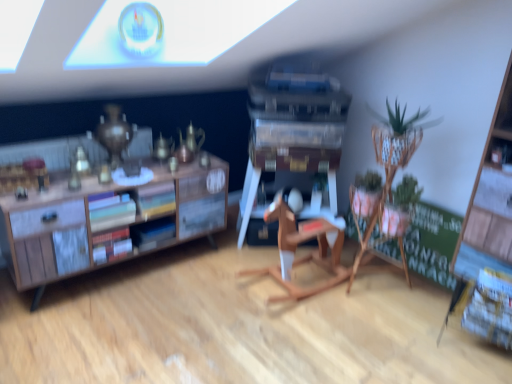
This screenshot has width=512, height=384. What are the coordinates of `vacant area to the left of wooden rocking horse at center` in the screenshot? It's located at (217, 292).